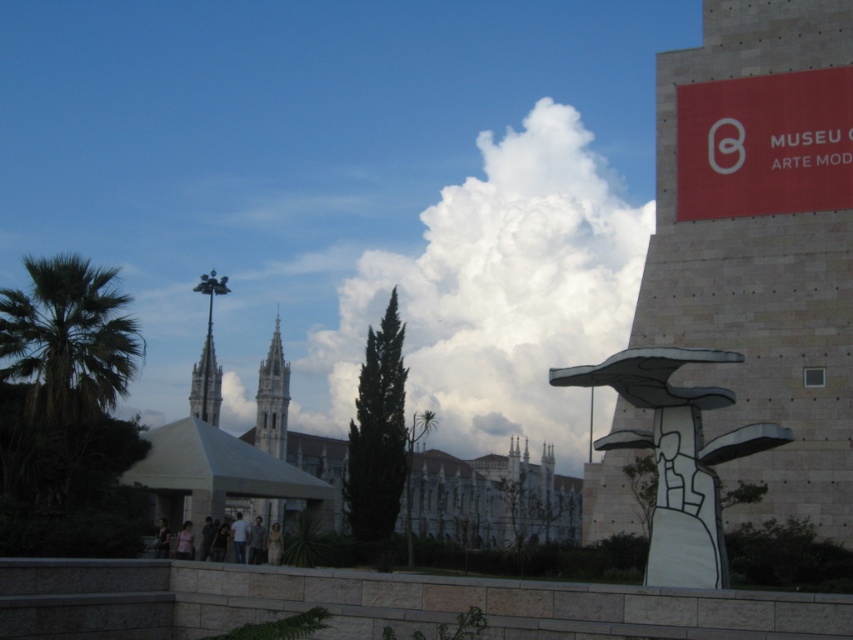
You are standing in the outdoor scene and want to take a photo of the white fluffy cloud at center and the beige stone tower at right. Which object appears taller in the photo?

The white fluffy cloud at center appears taller than the beige stone tower at right in the photo because the white fluffy cloud at center has a greater height compared to beige stone tower at right.